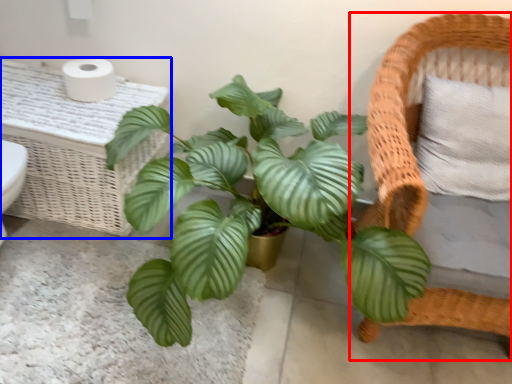
Question: Which object is further to the camera taking this photo, furniture (highlighted by a red box) or table (highlighted by a blue box)?

Choices:
 (A) furniture
 (B) table

Answer: (B)